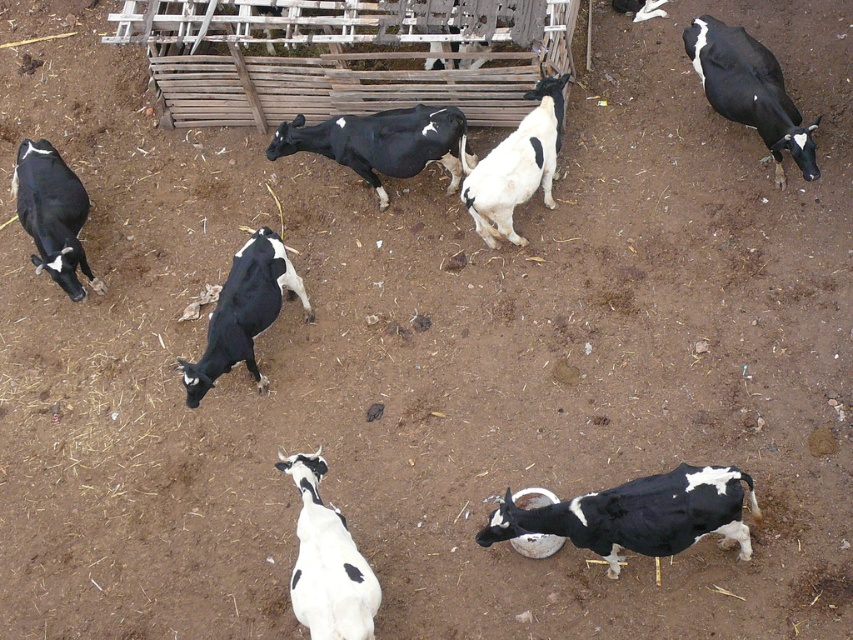
You are standing at the center of the farmyard and see the point marked at coordinates (749, 90). Which animal is this point located on?

The point marked at coordinates (749, 90) is located on the black glossy cow at upper right.